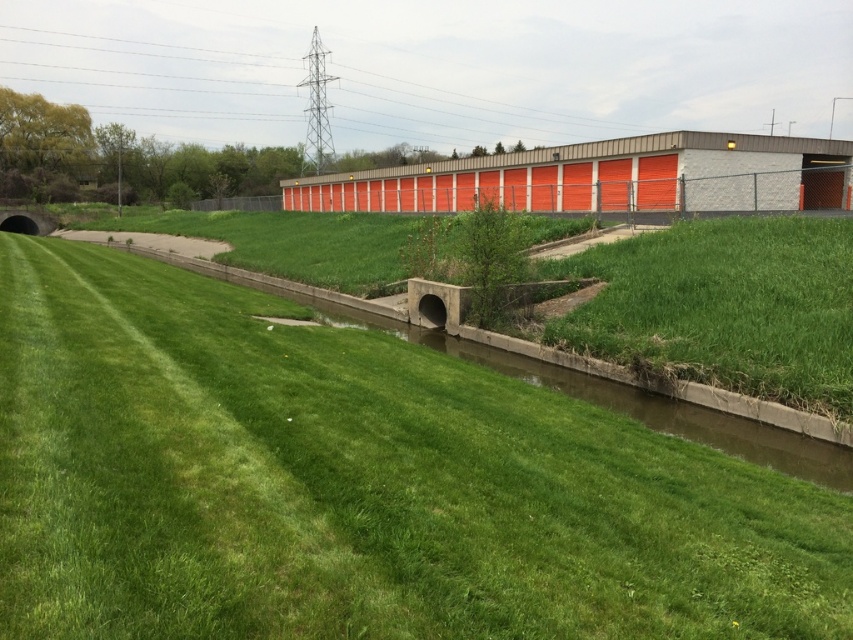
Question: Does green grass at center appear under green grassy at center?

Choices:
 (A) yes
 (B) no

Answer: (A)

Question: Which of the following is the farthest from the observer?

Choices:
 (A) green grassy at center
 (B) green grass at center

Answer: (A)

Question: Considering the relative positions of green grass at center and green grassy at center in the image provided, where is green grass at center located with respect to green grassy at center?

Choices:
 (A) left
 (B) right

Answer: (A)

Question: Does green grass at center have a lesser width compared to green grassy at center?

Choices:
 (A) no
 (B) yes

Answer: (A)

Question: Which point appears farthest from the camera in this image?

Choices:
 (A) (665, 349)
 (B) (520, 577)

Answer: (A)

Question: Which of the following is the closest to the observer?

Choices:
 (A) (628, 355)
 (B) (496, 497)

Answer: (B)